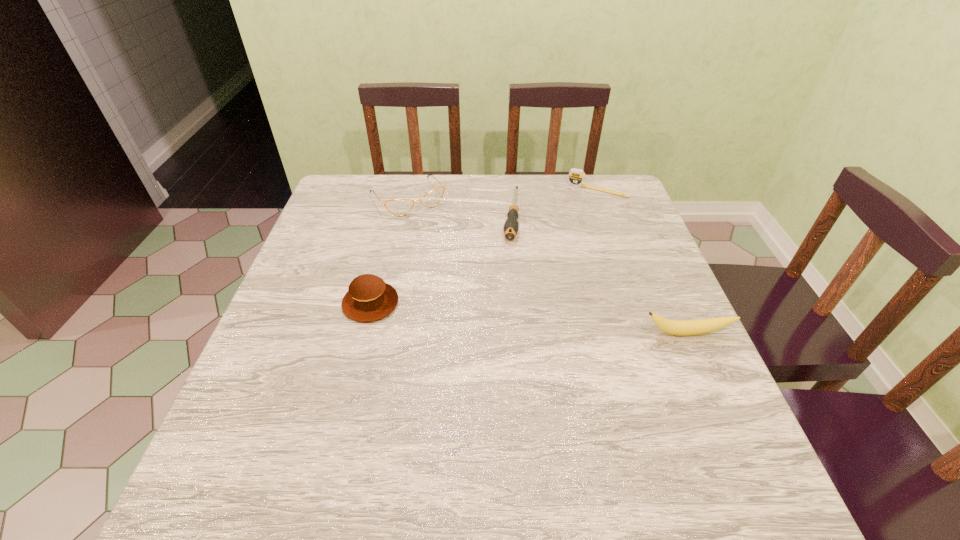
The height and width of the screenshot is (540, 960). I want to click on muffin positioned at the left edge, so click(x=369, y=298).

Find the location of a particular element. spectacles that is at the left edge is located at coordinates (399, 207).

In order to click on banana at the right edge in this screenshot , I will do `click(674, 327)`.

Identify the location of tape measure located at the right edge. The height and width of the screenshot is (540, 960). (576, 177).

At what (x,y) coordinates should I click in order to perform the action: click on object located at the far left corner. Please return your answer as a coordinate pair (x, y). Looking at the image, I should click on (399, 207).

I want to click on object located at the far right corner, so click(576, 177).

Identify the location of free point at the far edge. The height and width of the screenshot is (540, 960). (413, 193).

Where is `vacant space at the near edge of the desktop`? The height and width of the screenshot is (540, 960). vacant space at the near edge of the desktop is located at coordinates (566, 431).

Identify the location of free location at the left edge of the desktop. (290, 297).

You are a GUI agent. You are given a task and a screenshot of the screen. Output one action in this format:
    pyautogui.click(x=<x>, y=<y>)
    Task: Click on the free space at the right edge of the desktop
    Image resolution: width=960 pixels, height=540 pixels.
    Given the screenshot: What is the action you would take?
    pyautogui.click(x=615, y=232)